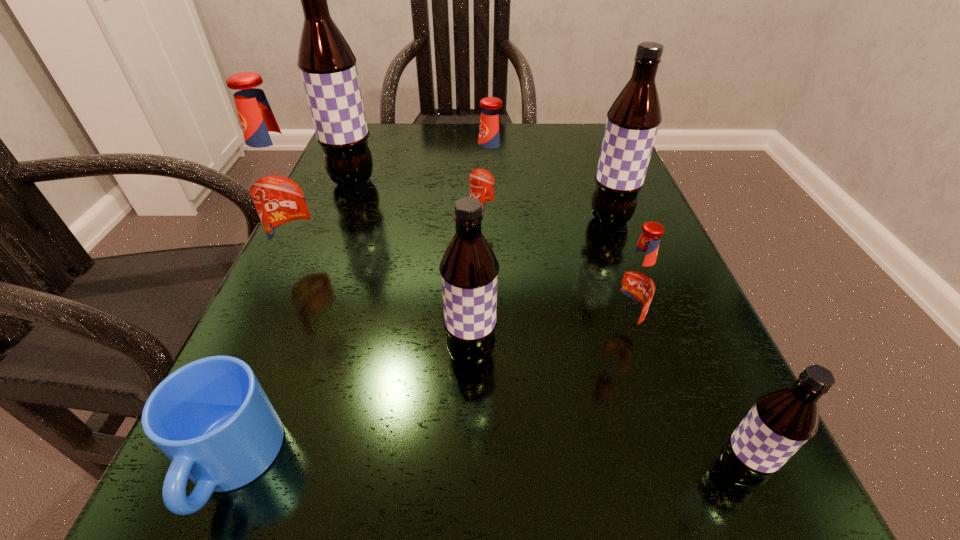
The image size is (960, 540). I want to click on vacant space located 0.360m on the left of the nearest brown root beer, so click(381, 472).

The image size is (960, 540). Identify the location of object located at the far edge. (327, 65).

Where is `root beer that is at the near edge`? The image size is (960, 540). root beer that is at the near edge is located at coordinates (783, 419).

Identify the location of mug that is at the near edge. (211, 418).

Locate an element on the screen. mug at the left edge is located at coordinates [211, 418].

At what (x,y) coordinates should I click in order to perform the action: click on object that is at the far left corner. Please return your answer as a coordinate pair (x, y). The height and width of the screenshot is (540, 960). Looking at the image, I should click on (327, 65).

In order to click on object present at the near left corner in this screenshot , I will do `click(211, 418)`.

Image resolution: width=960 pixels, height=540 pixels. Identify the location of object located in the near right corner section of the desktop. (783, 419).

The width and height of the screenshot is (960, 540). I want to click on free space at the far edge of the desktop, so click(467, 162).

This screenshot has width=960, height=540. I want to click on free space at the near edge of the desktop, so click(517, 516).